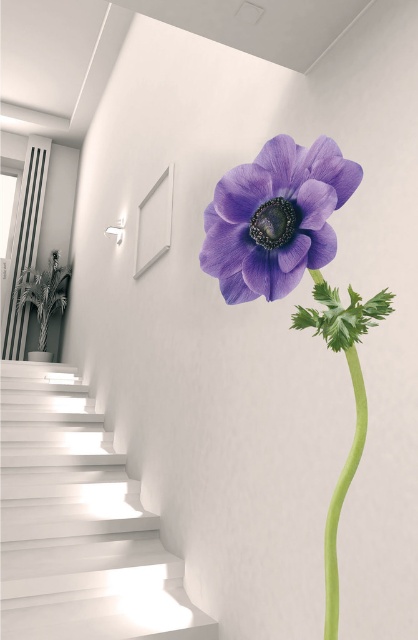
Question: Can you confirm if white smooth stairs at lower left is bigger than matte purple flower at center?

Choices:
 (A) yes
 (B) no

Answer: (A)

Question: Which point is closer to the camera?

Choices:
 (A) (331, 502)
 (B) (331, 156)
 (C) (20, 291)

Answer: (B)

Question: Is white smooth stairs at lower left wider than matte purple flower at center?

Choices:
 (A) yes
 (B) no

Answer: (A)

Question: Which object appears farthest from the camera in this image?

Choices:
 (A) green leafy plant at left
 (B) white smooth stairs at lower left
 (C) green smooth stem at center

Answer: (A)

Question: Among these points, which one is nearest to the camera?

Choices:
 (A) (325, 552)
 (B) (63, 440)

Answer: (A)

Question: Does white smooth stairs at lower left have a larger size compared to matte purple flower at center?

Choices:
 (A) yes
 (B) no

Answer: (A)